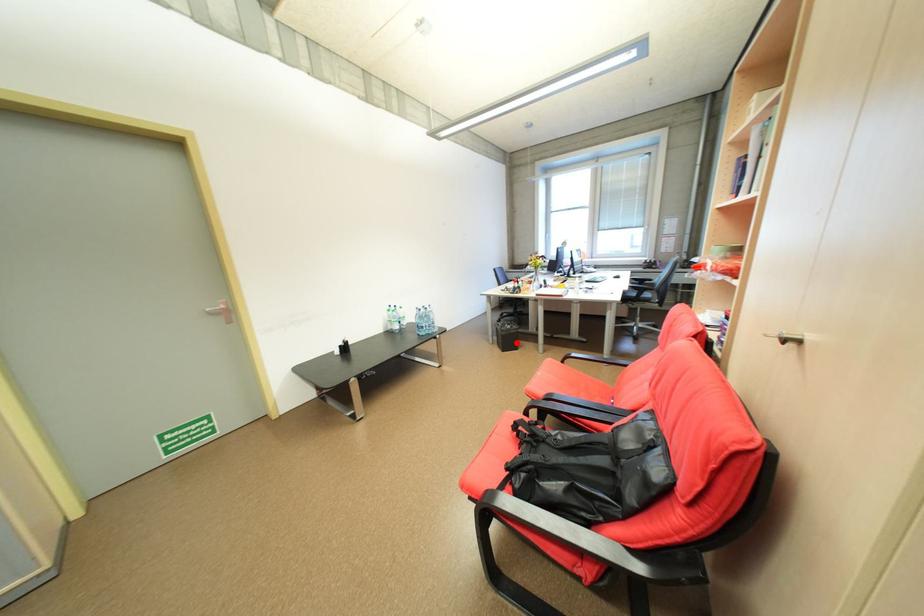
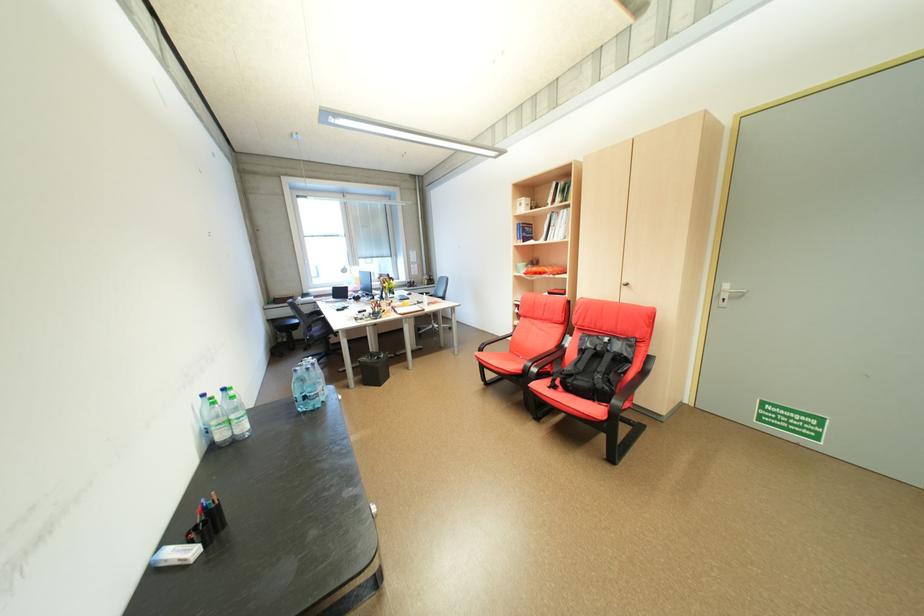
The point at the highlighted location is marked in the first image. Where is the corresponding point in the second image?

(382, 377)